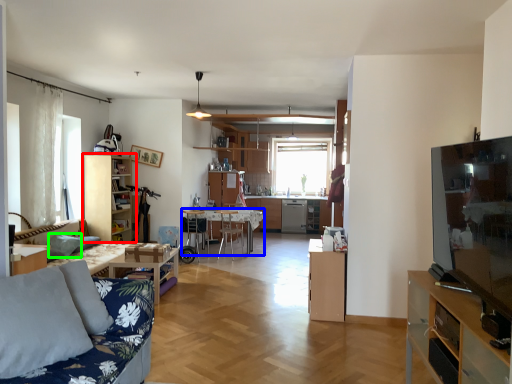
Question: Which object is the farthest from cabinetry (highlighted by a red box)? Choose among these: table (highlighted by a blue box) or pillow (highlighted by a green box).

Choices:
 (A) table
 (B) pillow

Answer: (A)